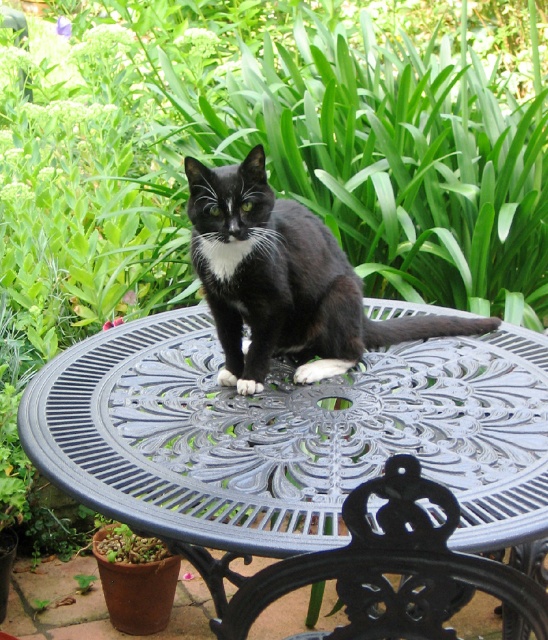
Question: Among these objects, which one is nearest to the camera?

Choices:
 (A) metallic gray table at center
 (B) matte black cat at center
 (C) black cast iron chair at center

Answer: (C)

Question: Can you confirm if black cast iron chair at center is smaller than metallic gray table at center?

Choices:
 (A) yes
 (B) no

Answer: (A)

Question: Among these points, which one is farthest from the camera?

Choices:
 (A) (255, 209)
 (B) (368, 561)
 (C) (92, 461)

Answer: (A)

Question: Observing the image, what is the correct spatial positioning of matte black cat at center in reference to black cast iron chair at center?

Choices:
 (A) below
 (B) above

Answer: (B)

Question: Which object is the closest to the metallic gray table at center?

Choices:
 (A) black cast iron chair at center
 (B) matte black cat at center

Answer: (A)

Question: Is black cast iron chair at center to the left of metallic gray table at center from the viewer's perspective?

Choices:
 (A) yes
 (B) no

Answer: (B)